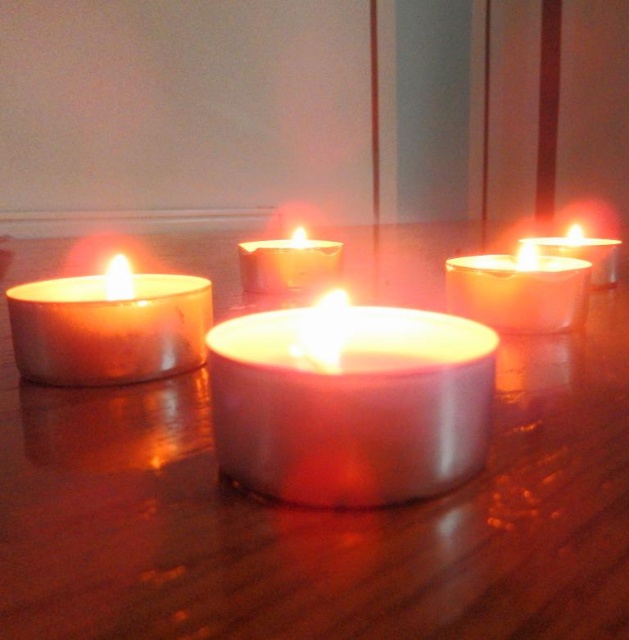
Question: Which point is farther to the camera?

Choices:
 (A) (591, 285)
 (B) (69, 276)
 (C) (172, 240)

Answer: (C)

Question: Observing the image, what is the correct spatial positioning of metallic silver candle at center in reference to matte white candle at right?

Choices:
 (A) below
 (B) above

Answer: (A)

Question: Observing the image, what is the correct spatial positioning of satin white candle at center in reference to matte white candle at right?

Choices:
 (A) above
 (B) below

Answer: (B)

Question: Which point is farther to the camera?

Choices:
 (A) (14, 326)
 (B) (60, 577)
 (C) (340, 476)

Answer: (A)

Question: Is matte silver candle at left further to the viewer compared to matte white candle at upper right?

Choices:
 (A) no
 (B) yes

Answer: (A)

Question: Which object appears closest to the camera in this image?

Choices:
 (A) satin white candle at center
 (B) matte silver candle at left
 (C) matte white candle at right
 (D) matte white candle at upper right

Answer: (A)